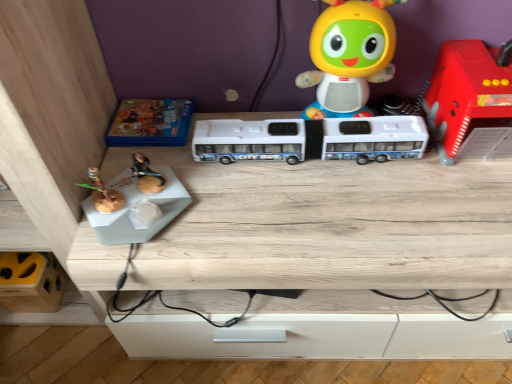
Image resolution: width=512 pixels, height=384 pixels. Find the location of `vacant space positioned to the left of white plastic bus at center, the 3th toy positioned from the left`. vacant space positioned to the left of white plastic bus at center, the 3th toy positioned from the left is located at coordinates coord(220,180).